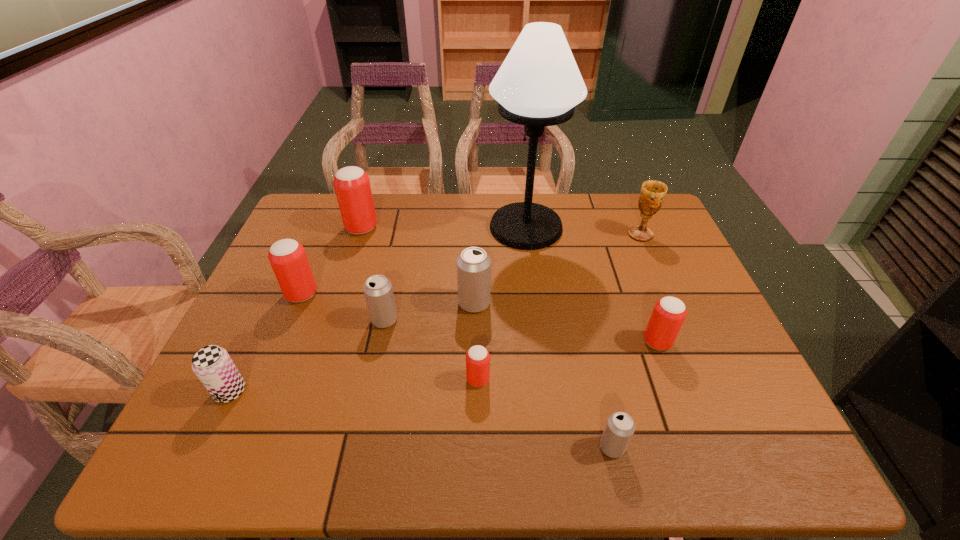
Find the location of `object located at the near edge`. object located at the near edge is located at coordinates (620, 427).

Identify the location of chalice that is positioned at the right edge. The width and height of the screenshot is (960, 540). pyautogui.click(x=652, y=194).

Locate an element on the screen. beer can situated at the right edge is located at coordinates (669, 313).

Where is `object present at the far right corner`? object present at the far right corner is located at coordinates (652, 194).

The height and width of the screenshot is (540, 960). Find the location of `free space at the far edge`. free space at the far edge is located at coordinates [436, 194].

The image size is (960, 540). Find the location of `free spot at the near edge of the desktop`. free spot at the near edge of the desktop is located at coordinates (255, 464).

In the image, there is a desktop. Identify the location of vacant space at the left edge. (235, 352).

I want to click on vacant region at the right edge of the desktop, so [x=645, y=287].

I want to click on free space at the near left corner of the desktop, so click(x=174, y=467).

This screenshot has width=960, height=540. I want to click on vacant space at the far right corner of the desktop, so click(x=628, y=221).